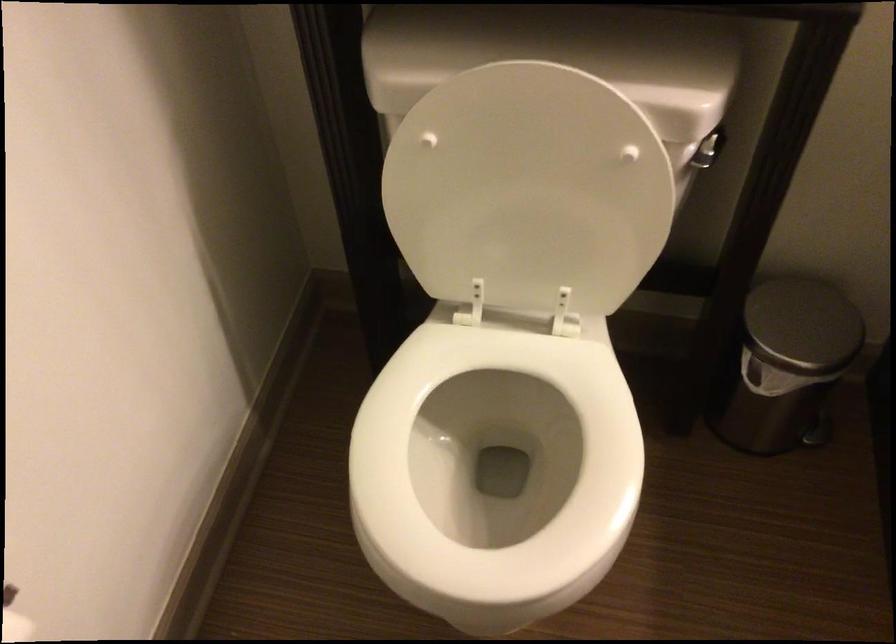
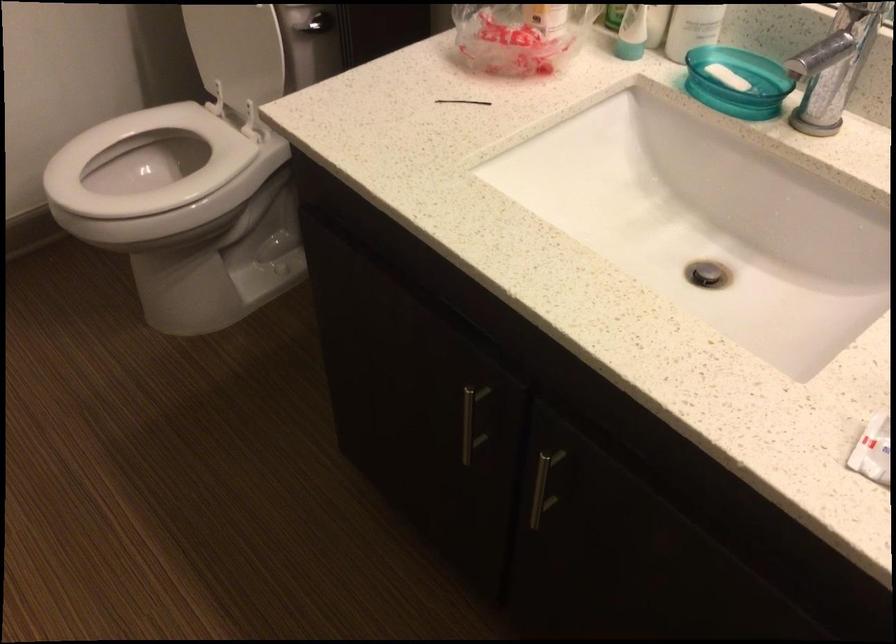
Question: I am providing you with two images of the same scene from different viewpoints. After the viewpoint changes to image2, which objects are now occluded?

Choices:
 (A) faucet handle
 (B) trekking pole grip
 (C) sink drain plug
 (D) trash can lid

Answer: (D)